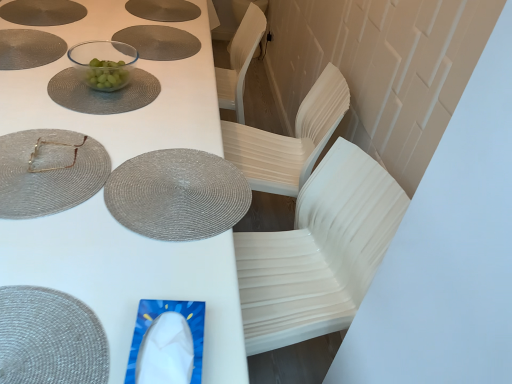
The image size is (512, 384). I want to click on vacant area that lies to the right of gold metallic square at upper left, placed as the 3th tableware when sorted from bottom to top, so click(x=134, y=164).